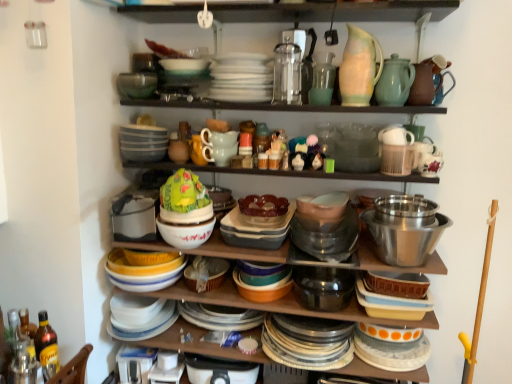
Question: Which direction should I rotate to face matte glass vase at upper center, the second tableware from the left, — up or down?

Choices:
 (A) down
 (B) up

Answer: (B)

Question: Can you confirm if polished stainless steel bowl at right, which is the first bowl from right to left, is thinner than matte glass vase at upper center, which is the fourth tableware from right to left?

Choices:
 (A) yes
 (B) no

Answer: (B)

Question: Is polished stainless steel bowl at right, which is the 4th bowl from left to right, wider than matte glass vase at upper center, which is the fourth tableware from right to left?

Choices:
 (A) no
 (B) yes

Answer: (B)

Question: Can you confirm if polished stainless steel bowl at right, acting as the second bowl starting from the bottom, is positioned to the left of matte glass vase at upper center, the second tableware from the left?

Choices:
 (A) yes
 (B) no

Answer: (B)

Question: Is polished stainless steel bowl at right, which is the 4th bowl from left to right, located outside matte glass vase at upper center, which is the fourth tableware from right to left?

Choices:
 (A) yes
 (B) no

Answer: (A)

Question: Does polished stainless steel bowl at right, acting as the second bowl starting from the bottom, lie behind matte glass vase at upper center, the second tableware from the left?

Choices:
 (A) no
 (B) yes

Answer: (A)

Question: Would you consider polished stainless steel bowl at right, the 3th bowl when ordered from top to bottom, to be distant from matte glass vase at upper center, which is the fourth tableware from right to left?

Choices:
 (A) yes
 (B) no

Answer: (B)

Question: Could you tell me if matte ceramic bowl at center, marked as the 4th bowl in a top-to-bottom arrangement, is turned towards green matte cake at center, which is the second food from right to left?

Choices:
 (A) yes
 (B) no

Answer: (B)

Question: Considering the relative sizes of matte ceramic bowl at center, the 3th bowl positioned from the left, and green matte cake at center, acting as the 1th food starting from the left, in the image provided, is matte ceramic bowl at center, the 3th bowl positioned from the left, wider than green matte cake at center, acting as the 1th food starting from the left,?

Choices:
 (A) yes
 (B) no

Answer: (A)

Question: From a real-world perspective, is matte ceramic bowl at center, marked as the 4th bowl in a top-to-bottom arrangement, over green matte cake at center, which is the second food from right to left?

Choices:
 (A) yes
 (B) no

Answer: (B)

Question: From the image's perspective, is matte ceramic bowl at center, which is the first bowl in bottom-to-top order, under green matte cake at center, acting as the 1th food starting from the left?

Choices:
 (A) no
 (B) yes

Answer: (B)

Question: Considering the relative sizes of matte ceramic bowl at center, marked as the 4th bowl in a top-to-bottom arrangement, and green matte cake at center, acting as the 1th food starting from the left, in the image provided, is matte ceramic bowl at center, marked as the 4th bowl in a top-to-bottom arrangement, shorter than green matte cake at center, acting as the 1th food starting from the left,?

Choices:
 (A) yes
 (B) no

Answer: (A)

Question: Is matte ceramic bowl at center, which is the first bowl in bottom-to-top order, positioned before green matte cake at center, which is the second food from right to left?

Choices:
 (A) yes
 (B) no

Answer: (B)

Question: Is polished stainless steel bowl at right, the 3th bowl when ordered from top to bottom, smaller than green matte cake at center, which is the second food from right to left?

Choices:
 (A) no
 (B) yes

Answer: (A)